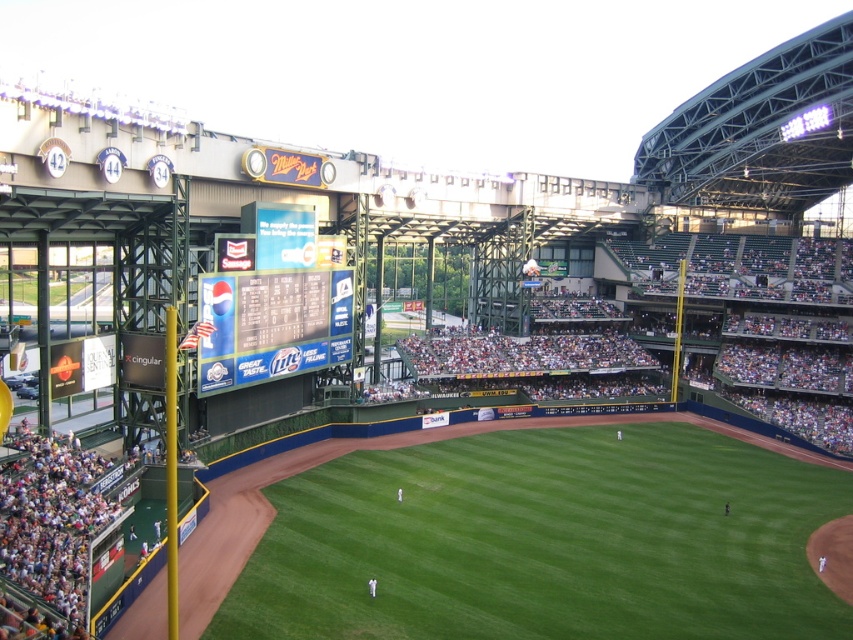
You are a drone operator preparing to fly a drone from the green grass field at center to the blue glossy scoreboard at center. The drone has a maximum flight range of 20 meters. Based on the scene, will the drone be able to reach the scoreboard?

The distance between the green grass field at center and the blue glossy scoreboard at center is 21.24 meters. Since the drone has a maximum flight range of 20 meters, it will not be able to reach the scoreboard.

You are a photographer at Miller Park and want to capture a photo of the green grass field at center and the dark green seats at center. From your current position, which object is closer to the camera?

The green grass field at center is positioned under the dark green seats at center, meaning it is closer to the camera.

You are a photographer planning to take a wide shot of the Miller Park stadium. You need to include both the green grass field at center and the dark green seats at center in your photo. Based on their relative widths, which object should you position closer to the center of the frame to ensure both are fully visible?

Since the green grass field at center has a lesser width compared to the dark green seats at center, you should position the wider dark green seats at center closer to the center of the frame to ensure both objects are fully visible in the photo.